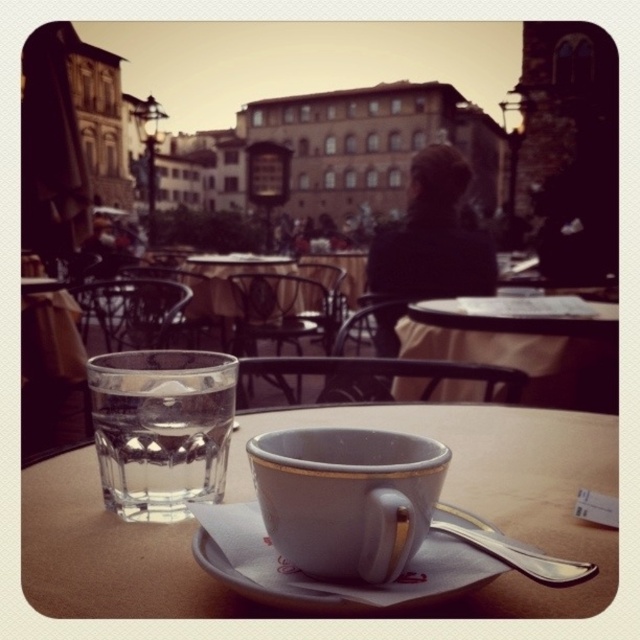
You are a customer at this European city cafe and want to place your phone on the table. The phone has a width of 8 cm. The table is 60 cm wide. The matte ceramic cup at center is located at point 0.778, 0.542. Can you place your phone on the table without moving the cup?

The matte ceramic cup at center is located at point (346, 497). Since the table is 60 cm wide and the phone is only 8 cm wide, there should be enough space on the table to place the phone without moving the cup, provided the cup isn not blocking the entire surface.

You are a photographer standing at the edge of the outdoor European city cafe scene. You want to take a photo that includes both the point at coordinate [74,572] and the point at coordinate [243,573]. Which point should you focus on first to ensure both are in focus?

You should focus on point [74,572] first because it is closer to the camera than point [243,573]. This ensures that both points will be within the depth of field when using a small aperture setting.

Looking at this image, you are a customer sitting at the table and want to reach for the matte ceramic cup at center and the white ceramic saucer at center. Which object is positioned to the right side?

The matte ceramic cup at center is positioned to the right of the white ceramic saucer at center.